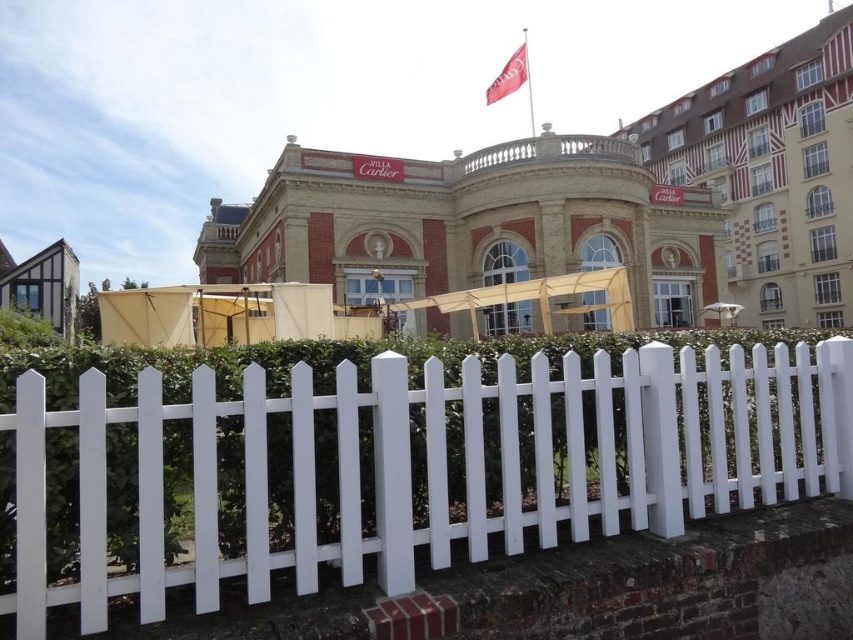
You are standing in front of the historic Villa Cartier building and want to enter through the main entrance. There is a white picket fence at center blocking your path. Can you walk around it to reach the entrance?

The white picket fence at center is 2.80 meters away from you. Since the fence is at the center, you can walk around it either to the left or right to reach the entrance.

You are standing in the middle of a park and see the white picket fence at center and the red brick building at upper right. Which object is closer to you?

The white picket fence at center is closer to you because it is positioned under the red brick building at upper right, indicating it is in front of the building.